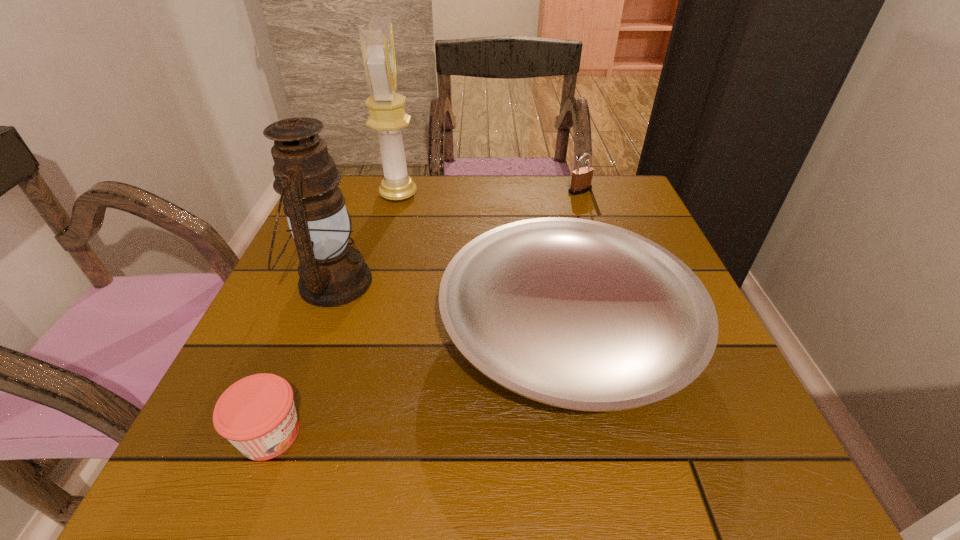
You are a GUI agent. You are given a task and a screenshot of the screen. Output one action in this format:
    pyautogui.click(x=<x>, y=<y>)
    Task: Click on the free space between the third tallest object and the oil lamp
    This screenshot has height=540, width=960.
    Given the screenshot: What is the action you would take?
    pyautogui.click(x=456, y=237)

This screenshot has width=960, height=540. In order to click on free spot between the bedpan and the jam in this screenshot , I will do `click(419, 381)`.

Find the location of a particular element. This screenshot has width=960, height=540. empty space between the oil lamp and the award is located at coordinates (365, 239).

Identify the location of object that is the second closest one to the tallest object. (578, 314).

This screenshot has width=960, height=540. I want to click on object that can be found as the second closest to the jam, so click(578, 314).

The height and width of the screenshot is (540, 960). I want to click on free space that satisfies the following two spatial constraints: 1. on the front-facing side of the tallest object; 2. on the right side of the bedpan, so click(363, 328).

What are the coordinates of `vacant region that satisfies the following two spatial constraints: 1. on the front-facing side of the award; 2. on the back side of the bedpan` in the screenshot? It's located at (363, 328).

Locate an element on the screen. The width and height of the screenshot is (960, 540). vacant point that satisfies the following two spatial constraints: 1. on the front side of the oil lamp; 2. on the right side of the bedpan is located at coordinates (315, 328).

Find the location of a particular element. The width and height of the screenshot is (960, 540). vacant region that satisfies the following two spatial constraints: 1. on the front side of the padlock; 2. on the front label of the jam is located at coordinates (661, 434).

Locate an element on the screen. This screenshot has width=960, height=540. free spot that satisfies the following two spatial constraints: 1. on the front side of the second tallest object; 2. on the front label of the jam is located at coordinates (275, 434).